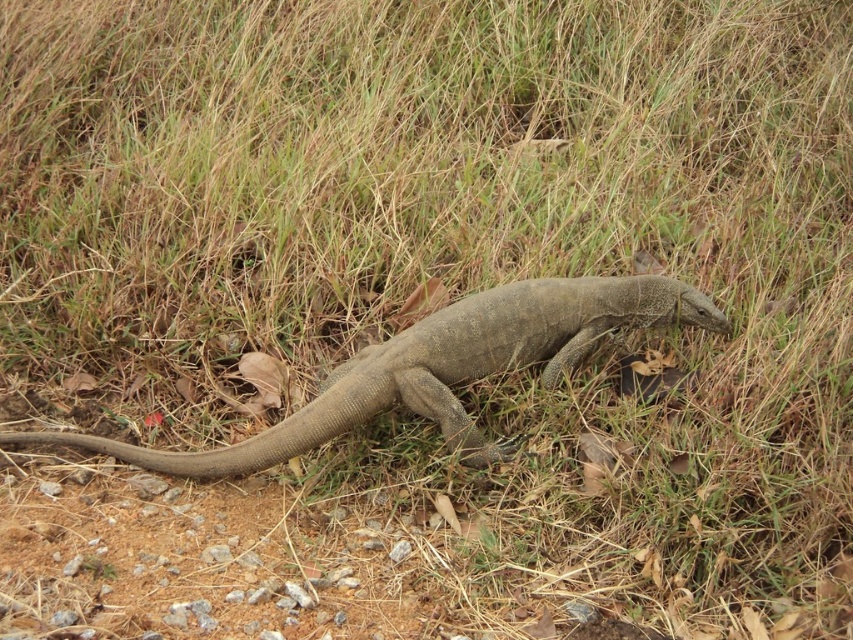
You are an observer looking at the image. You see a gray textured lizard at center and a brown rough tail at lower left. Which object is positioned to the right of the other?

The gray textured lizard at center is positioned to the right of the brown rough tail at lower left.

You are standing in a forest clearing and see the gray textured lizard at center. If you want to take a closer look without disturbing it, what is the minimum distance you should maintain to ensure safety?

The gray textured lizard at center is 2.56 meters away from the viewer. To avoid disturbing it, you should maintain a distance of at least 2.56 meters or more.